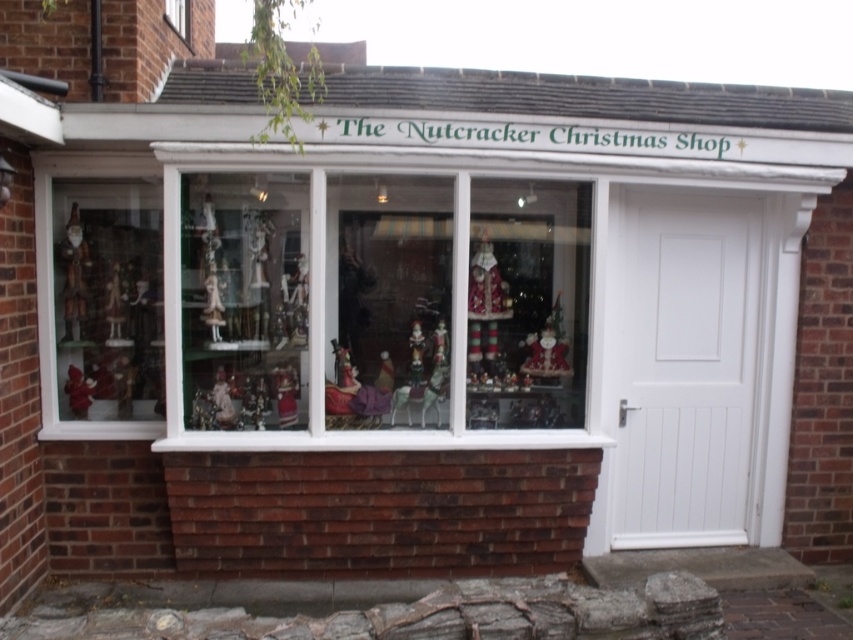
Question: Can you confirm if translucent glass ornaments at center is smaller than matte red santa at center?

Choices:
 (A) yes
 (B) no

Answer: (B)

Question: Does wooden figurines at left appear on the left side of matte red santa at center?

Choices:
 (A) yes
 (B) no

Answer: (A)

Question: Does wooden figurines at left have a lesser width compared to matte red santa at center?

Choices:
 (A) no
 (B) yes

Answer: (A)

Question: Which point appears closest to the camera in this image?

Choices:
 (A) (77, 337)
 (B) (281, 422)
 (C) (495, 307)

Answer: (B)

Question: Which is nearer to the wooden figurines at left?

Choices:
 (A) wooden santa at left
 (B) translucent glass ornaments at center

Answer: (A)

Question: Which object appears closest to the camera in this image?

Choices:
 (A) translucent glass ornaments at center
 (B) matte red figurine at lower left

Answer: (A)